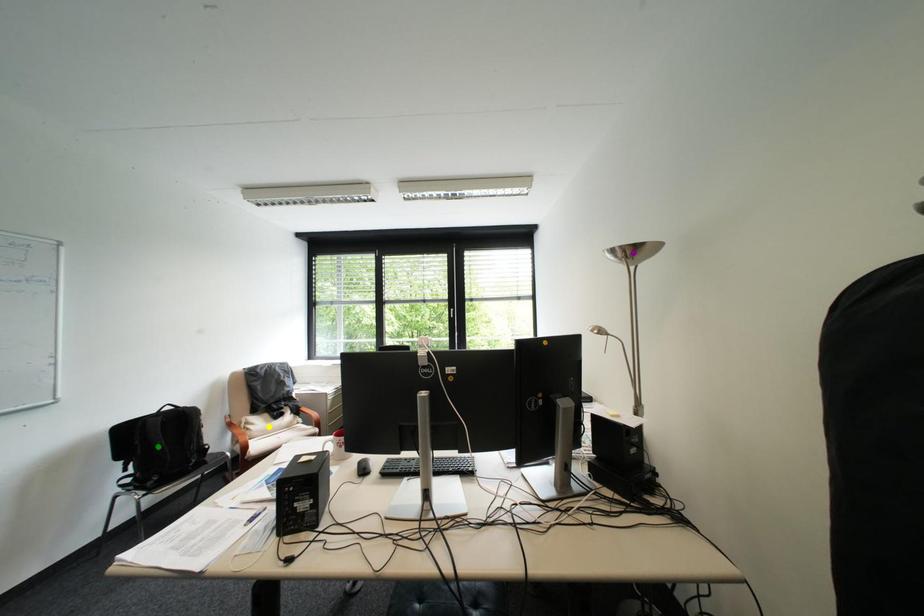
Order these from nearest to farthest:
purple point
green point
yellow point

yellow point
green point
purple point